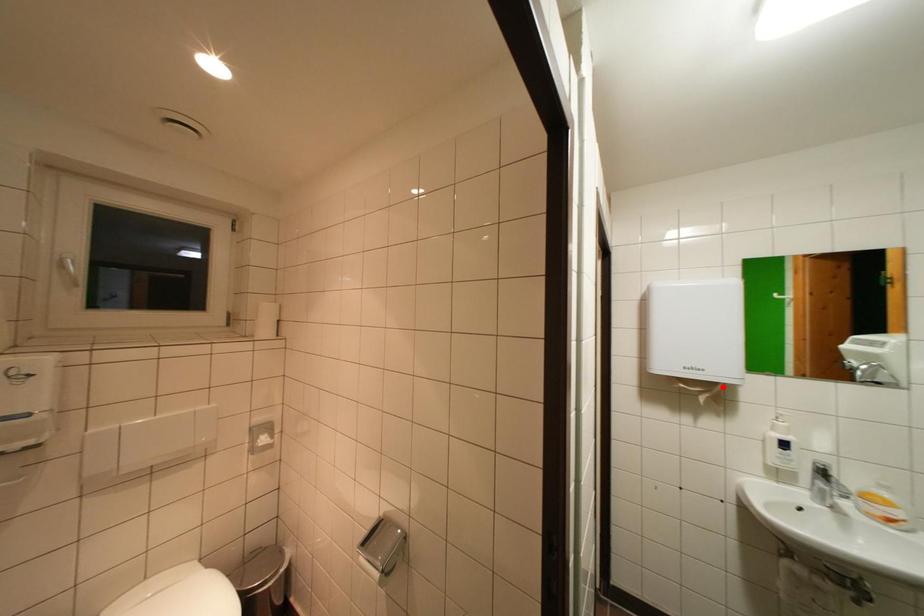
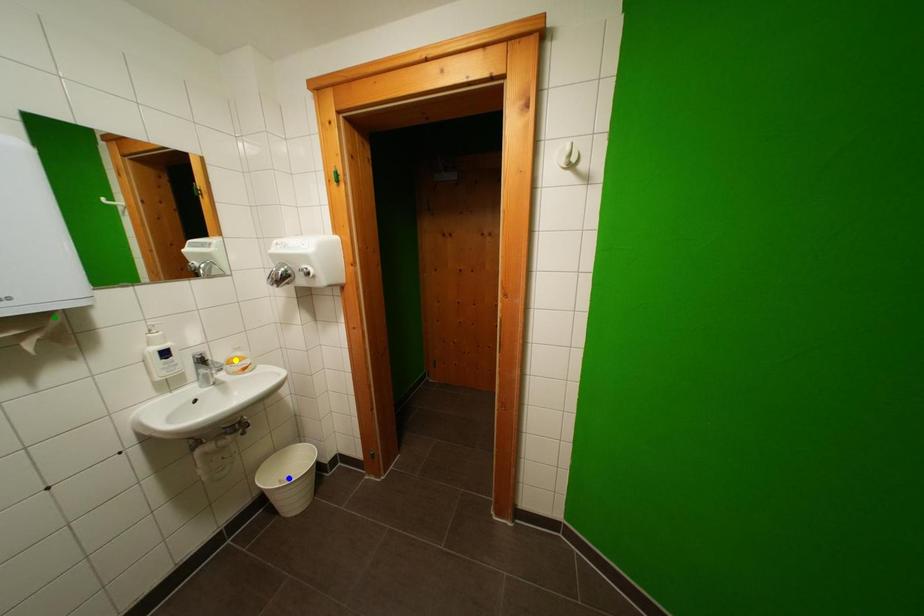
Question: I am providing you with two images of the same scene from different viewpoints. A red point is marked on the first image. You are given multiple points on the second image. Which spot in image 2 lines up with the point in image 1?

Choices:
 (A) blue point
 (B) green point
 (C) yellow point

Answer: (B)